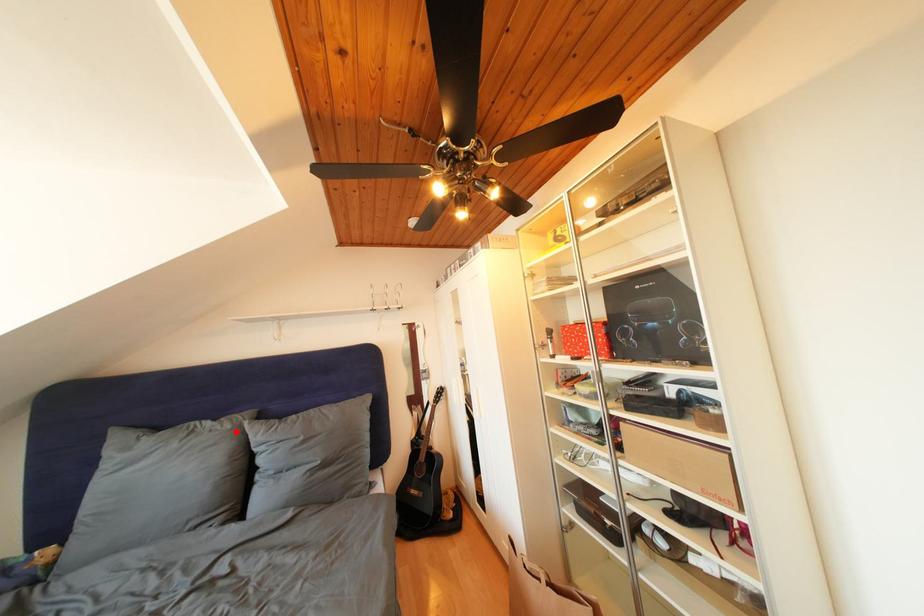
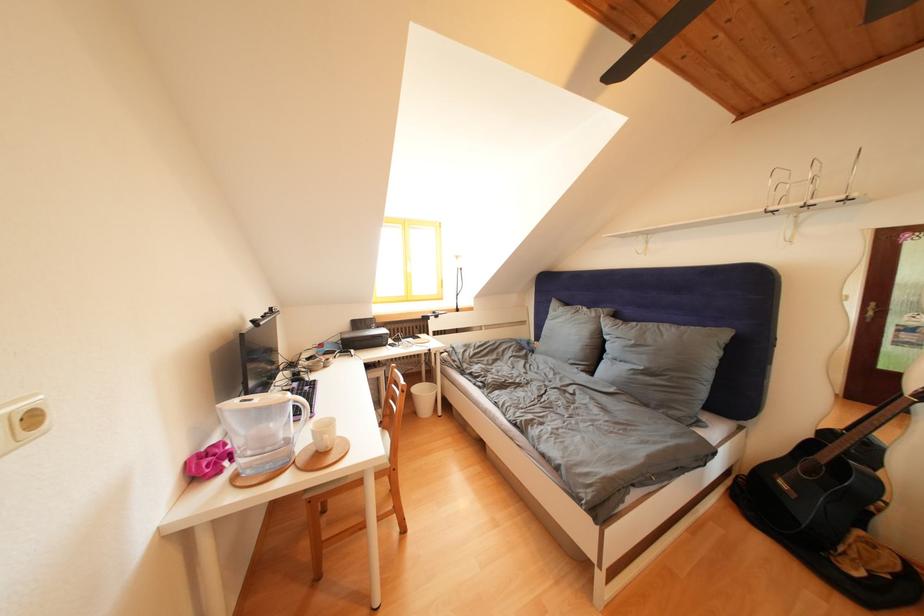
Question: I am providing you with two images of the same scene from different viewpoints. A red point is marked on the first image. Can you still see the location of the red point in image 2?

Choices:
 (A) Yes
 (B) No

Answer: (A)